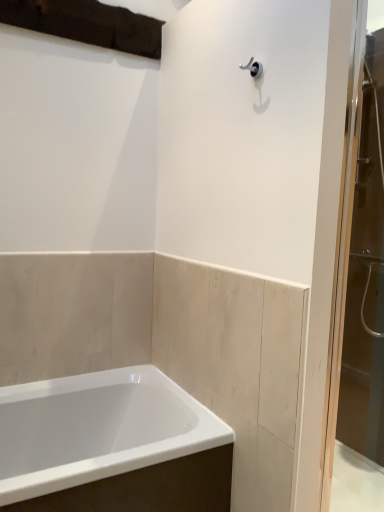
Question: Considering the positions of point (340, 294) and point (180, 472), is point (340, 294) closer or farther from the camera than point (180, 472)?

Choices:
 (A) closer
 (B) farther

Answer: (A)

Question: From the image's perspective, is transparent glass screen door at right above or below white glossy bathtub at lower left?

Choices:
 (A) above
 (B) below

Answer: (A)

Question: Based on their sizes in the image, would you say transparent glass screen door at right is bigger or smaller than white glossy bathtub at lower left?

Choices:
 (A) big
 (B) small

Answer: (B)

Question: From the image's perspective, relative to transparent glass screen door at right, is white glossy bathtub at lower left above or below?

Choices:
 (A) below
 (B) above

Answer: (A)

Question: Considering the positions of white glossy bathtub at lower left and transparent glass screen door at right in the image, is white glossy bathtub at lower left taller or shorter than transparent glass screen door at right?

Choices:
 (A) short
 (B) tall

Answer: (A)

Question: Based on their sizes in the image, would you say white glossy bathtub at lower left is bigger or smaller than transparent glass screen door at right?

Choices:
 (A) big
 (B) small

Answer: (A)

Question: From a real-world perspective, is white glossy bathtub at lower left above or below transparent glass screen door at right?

Choices:
 (A) below
 (B) above

Answer: (A)